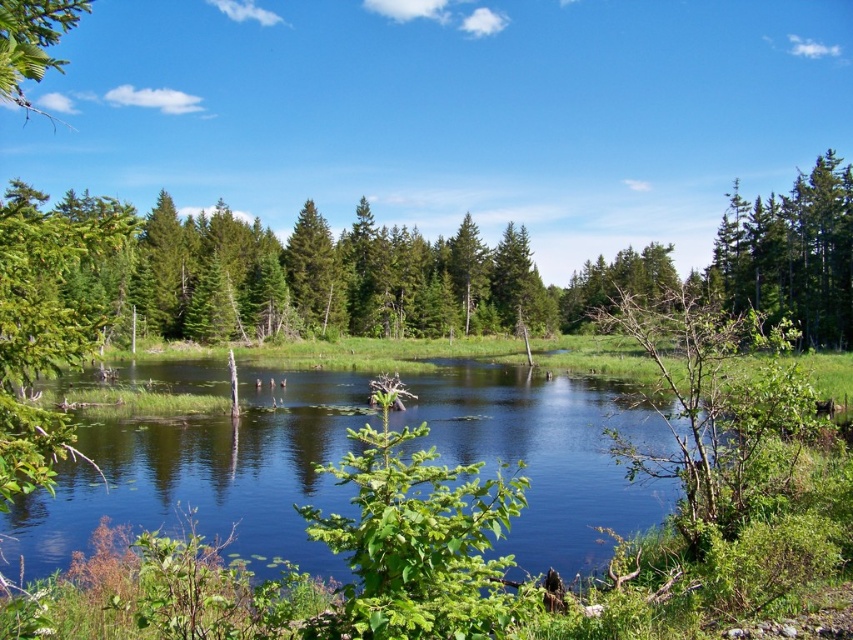
What are the coordinates of the clear water at center?

The clear water at center is located at point [206,474].

You are an environmental scientist analyzing the growth patterns of trees in this area. You observe the green matte tree at upper right and the green matte tree at center. Which tree would you expect to have a larger canopy area based on their sizes in the image?

The green matte tree at upper right has a larger canopy area than the green matte tree at center because it is bigger in size according to the image.